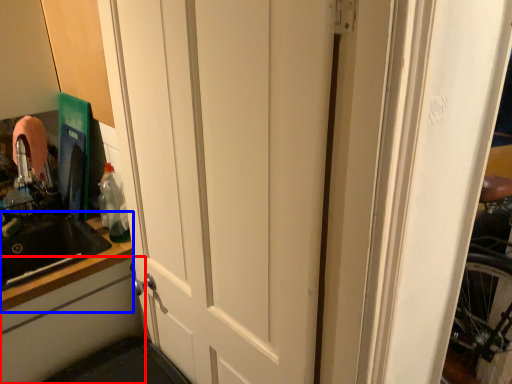
Question: Which point is closer to the camera, cabinetry (highlighted by a red box) or counter top (highlighted by a blue box)?

Choices:
 (A) cabinetry
 (B) counter top

Answer: (A)